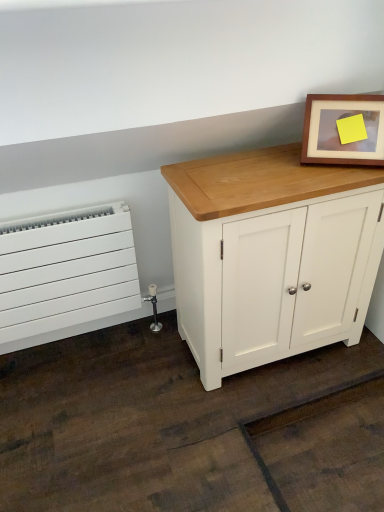
Question: Is wooden picture frame at upper right wider or thinner than white matte radiator at left?

Choices:
 (A) wide
 (B) thin

Answer: (A)

Question: From the image's perspective, is wooden picture frame at upper right above or below white matte radiator at left?

Choices:
 (A) below
 (B) above

Answer: (B)

Question: Estimate the real-world distances between objects in this image. Which object is closer to the white painted wood cabinet at center?

Choices:
 (A) white matte radiator at left
 (B) wooden picture frame at upper right

Answer: (B)

Question: Considering the real-world distances, which object is closest to the white matte radiator at left?

Choices:
 (A) white painted wood cabinet at center
 (B) wooden picture frame at upper right

Answer: (A)